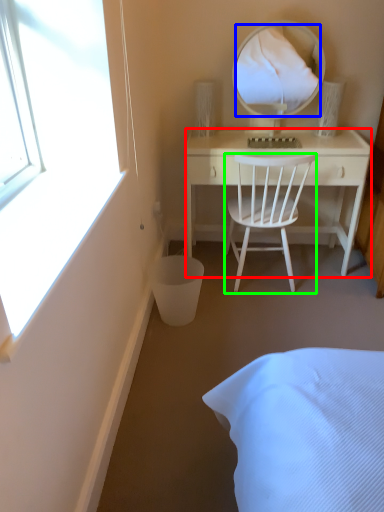
Question: Which object is positioned farthest from desk (highlighted by a red box)? Select from mirror (highlighted by a blue box) and chair (highlighted by a green box).

Choices:
 (A) mirror
 (B) chair

Answer: (A)